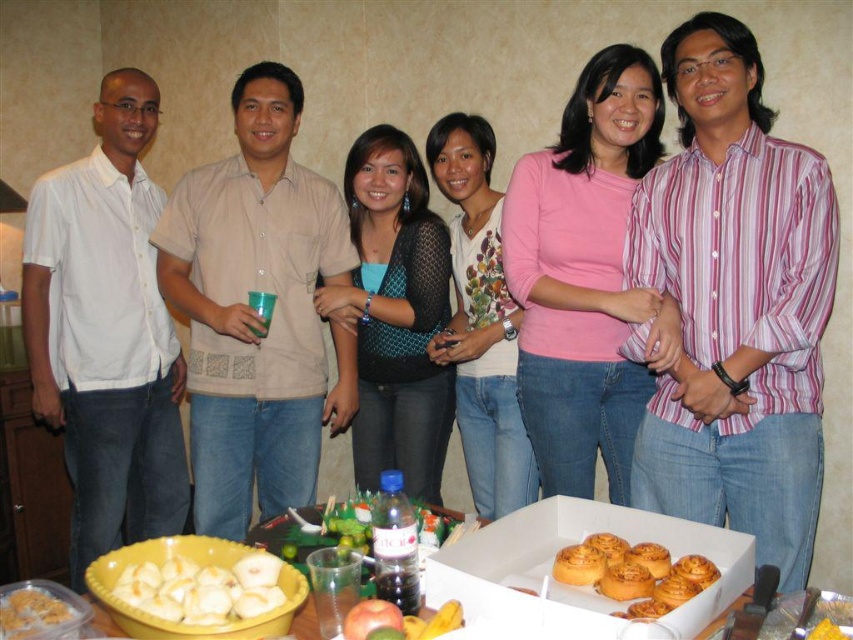
You are a photographer at the event and want to capture a photo of the teal mesh top at center and the yellow cake at center. Which object is wider so that it can be framed better in the photo?

The teal mesh top at center is wider than the yellow cake at center, so it can be framed better in the photo.

You are a guest at this gathering and see the yellow plastic bowl at lower left and the yellow cake at center. If you want to serve yourself a slice of the cake, which container could you use to hold it without it spilling?

The yellow plastic bowl at lower left is bigger than the yellow cake at center, so it can hold the cake without spilling.